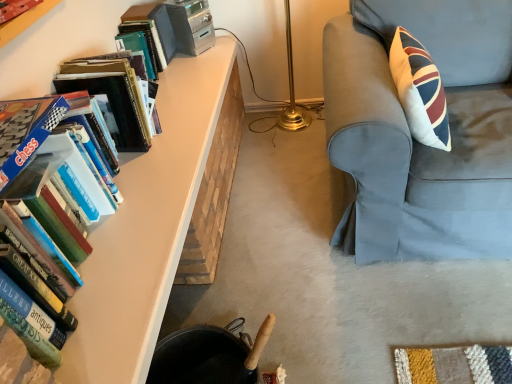
Where is `vacant space in front of gold metallic table lamp at center`? vacant space in front of gold metallic table lamp at center is located at coordinates (298, 170).